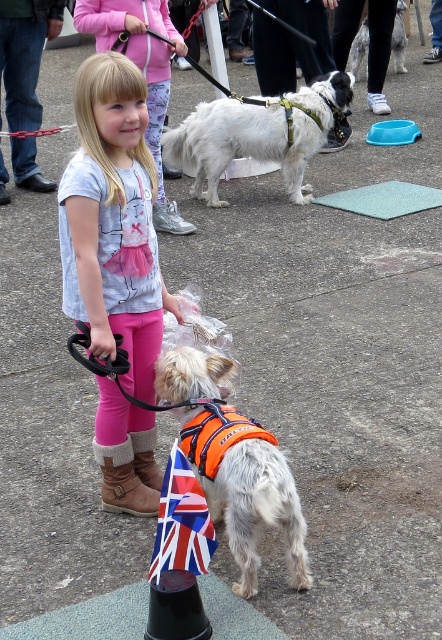
Question: From the image, what is the correct spatial relationship of white soft fur dog at upper center in relation to brown suede boot at lower left?

Choices:
 (A) above
 (B) below

Answer: (A)

Question: Among these objects, which one is farthest from the camera?

Choices:
 (A) matte pink leggings at center
 (B) brown suede boot at lower left
 (C) union jack fabric flag at lower center

Answer: (B)

Question: Is brown suede boot at lower left closer to camera compared to white fur dog at center?

Choices:
 (A) no
 (B) yes

Answer: (B)

Question: Which object is closer to the camera taking this photo?

Choices:
 (A) brown suede boot at lower left
 (B) matte pink leggings at center

Answer: (B)

Question: Is the position of matte pink leggings at center more distant than that of brown suede boot at lower left?

Choices:
 (A) no
 (B) yes

Answer: (A)

Question: Which of these objects is positioned farthest from the orange fabric dog at center?

Choices:
 (A) brown suede boot at lower left
 (B) white soft fur dog at upper center
 (C) white fur dog at center

Answer: (C)